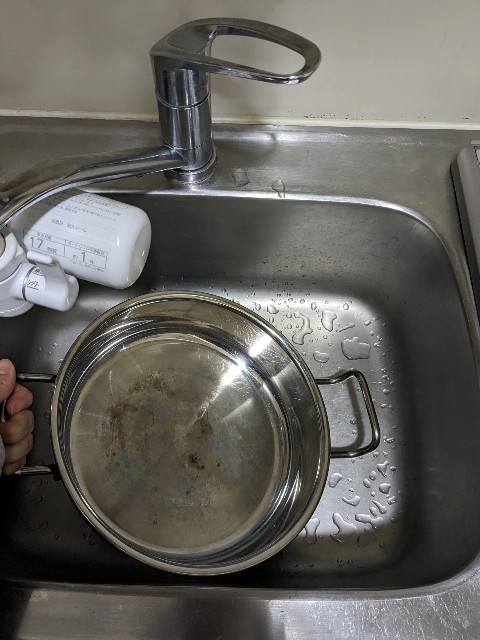
The image size is (480, 640). I want to click on wall, so click(x=406, y=76).